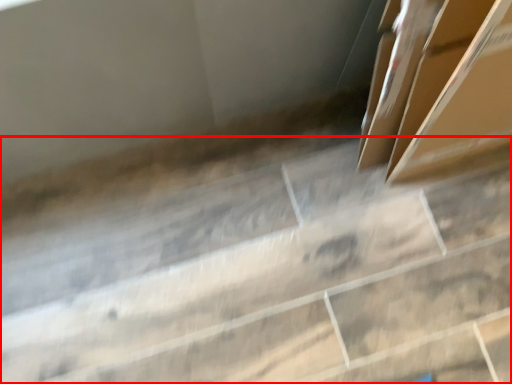
Question: From the image, what is the correct spatial relationship of concrete (annotated by the red box) in relation to box?

Choices:
 (A) right
 (B) left

Answer: (B)